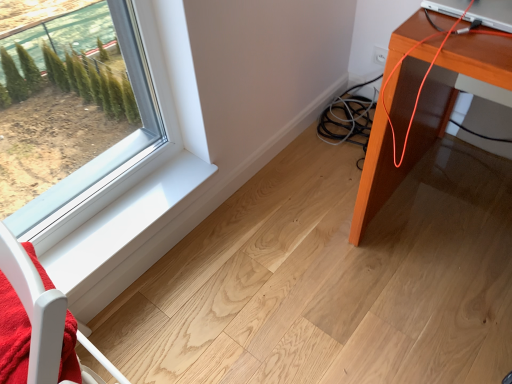
Find the location of a particular element. Image resolution: width=512 pixels, height=384 pixels. blank space situated above white smooth window sill at lower left (from a real-world perspective) is located at coordinates (125, 215).